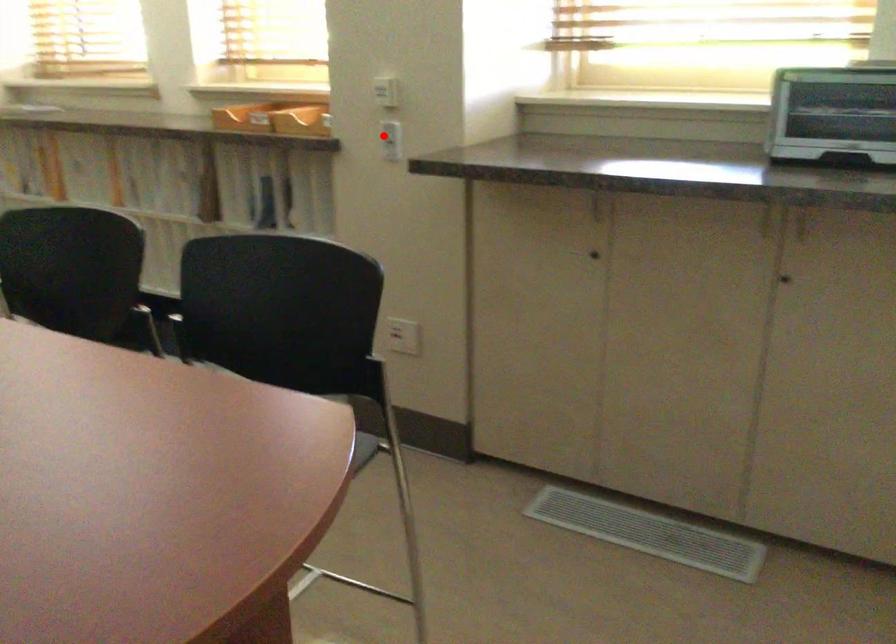
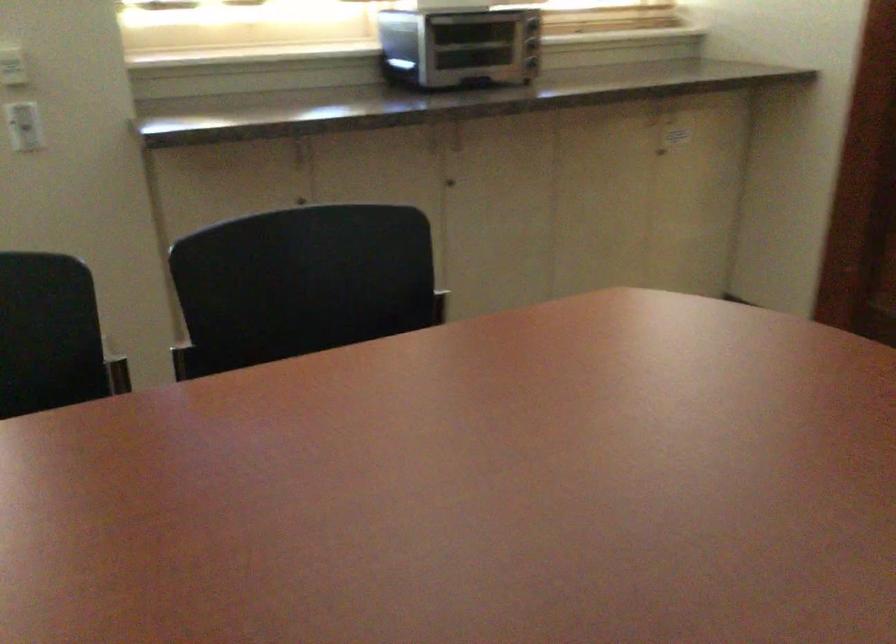
Locate, in the second image, the point that corresponds to the highlighted location in the first image.

(24, 126)